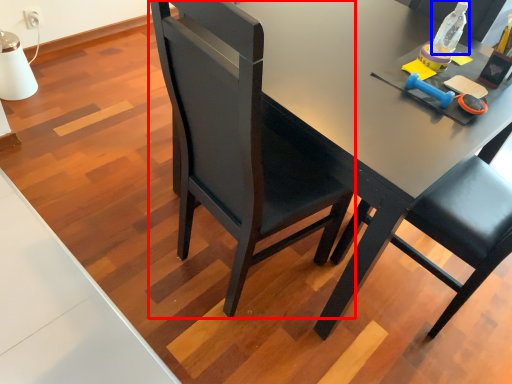
Question: Among these objects, which one is farthest to the camera, chair (highlighted by a red box) or bottle (highlighted by a blue box)?

Choices:
 (A) chair
 (B) bottle

Answer: (B)